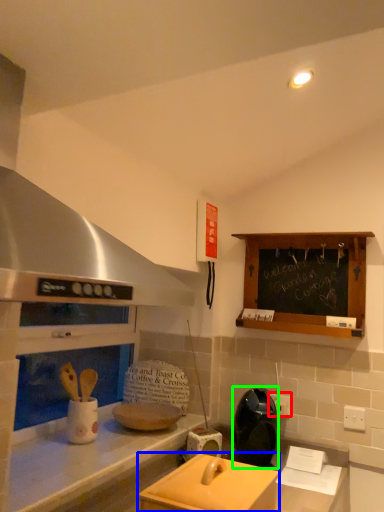
Question: Which object is positioned closest to electric outlet (highlighted by a red box)? Select from appliance (highlighted by a blue box) and appliance (highlighted by a green box).

Choices:
 (A) appliance
 (B) appliance

Answer: (B)